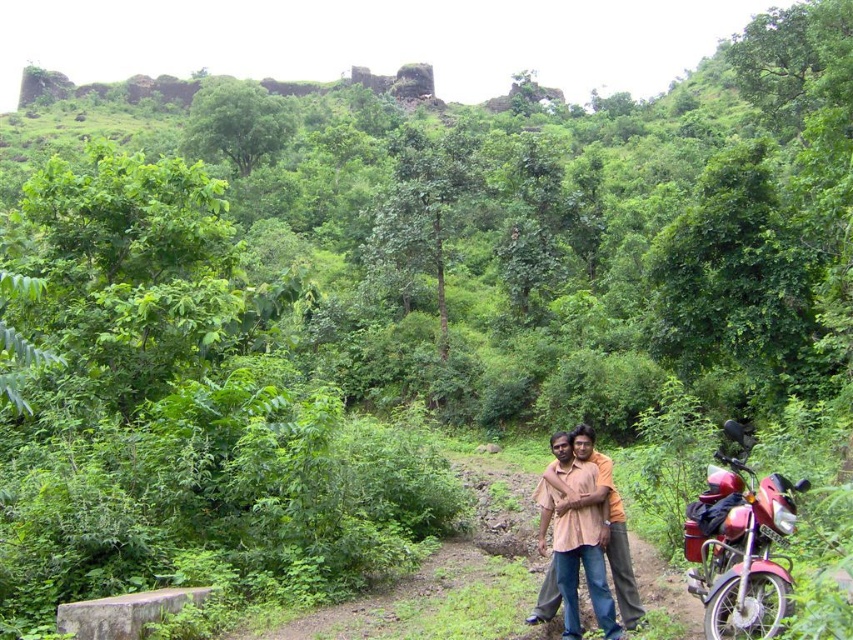
You are standing at the center of the image and want to locate the metallic red motorcycle at lower right. According to the coordinates given, in which direction should you look to find it?

The metallic red motorcycle at lower right is located at coordinates point (740, 550), which means it is positioned to the lower right direction from your current position at the center.

You are a photographer trying to capture a photo of the light brown cotton shirt at center and the metallic red motorcycle at lower right. Based on their heights, which object should you focus on first if you want to ensure both are in frame without adjusting your camera angle?

The metallic red motorcycle at lower right is shorter than the light brown cotton shirt at center, so you should focus on the light brown cotton shirt at center first to ensure both are in frame.

From the picture: You are a photographer wanting to capture the metallic red motorcycle at lower right and the light brown cotton shirt at center in the same frame. Which object should you position closer to the camera to ensure both are in focus?

To ensure both the metallic red motorcycle at lower right and the light brown cotton shirt at center are in focus, position the light brown cotton shirt at center closer to the camera since it is further away from the camera than the metallic red motorcycle at lower right.